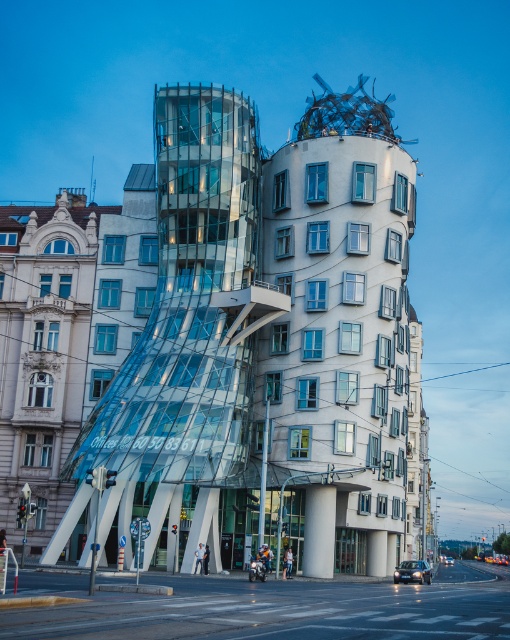
Question: Which point is closer to the camera?

Choices:
 (A) white smooth pillar at center
 (B) transparent glass building at center

Answer: (B)

Question: Is transparent glass building at center bigger than white smooth pillar at center?

Choices:
 (A) no
 (B) yes

Answer: (B)

Question: Which of the following is the farthest from the observer?

Choices:
 (A) (263, 480)
 (B) (333, 515)

Answer: (B)

Question: Can you confirm if transparent glass building at center is smaller than white smooth pillar at center?

Choices:
 (A) no
 (B) yes

Answer: (A)

Question: Is transparent glass building at center wider than white smooth pillar at center?

Choices:
 (A) no
 (B) yes

Answer: (B)